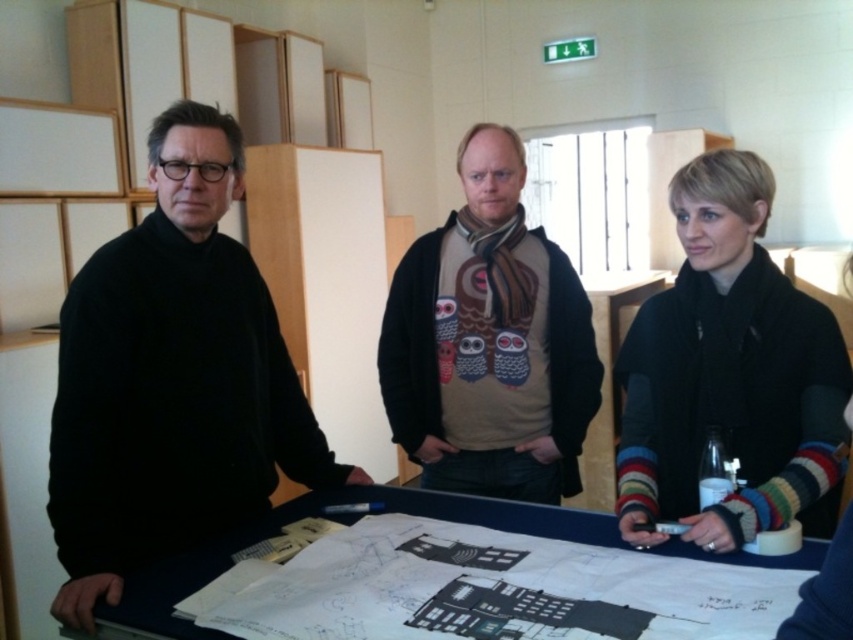
You are a photographer standing at a distance of 1.5 meters from the camera. You want to take a closeup photo of the black woolen scarf at center. Can you move closer to the scarf to get a better shot?

The distance between the black woolen scarf at center and the camera is 1.39 meters. Since you are currently 1.5 meters away from the camera, you can move 0.11 meters closer to the scarf to get a better shot.

You are organizing a clothing donation drive and need to categorize sweaters by size. You have two sweaters in front of you, the black matte sweater at left and the olive green sweater at center. Which sweater should you place in the large size bin?

The black matte sweater at left should be placed in the large size bin since it is larger in size than the olive green sweater at center.

You are standing in the office and need to hand a document to both people wearing the black matte sweater at left and the olive green sweater at center. Based on their positions, which person should you approach first if you want to reach the one closer to you?

The black matte sweater at left is located below olive green sweater at center, so the person wearing the black matte sweater at left is closer to you. You should approach them first.